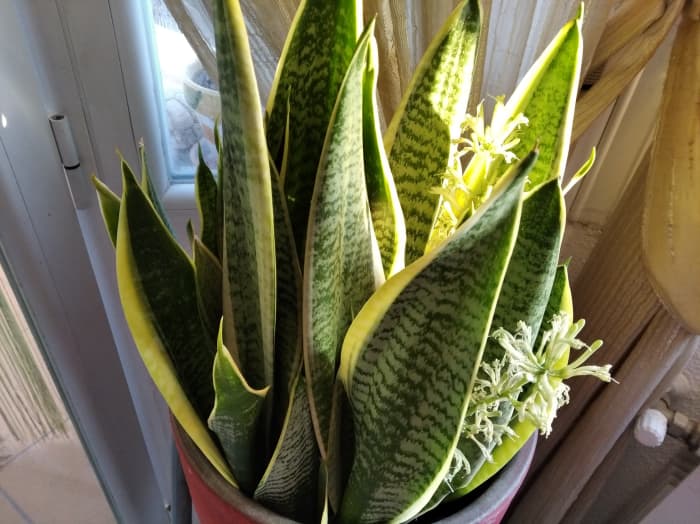
Image resolution: width=700 pixels, height=524 pixels. In order to click on window in this screenshot , I will do `click(178, 72)`.